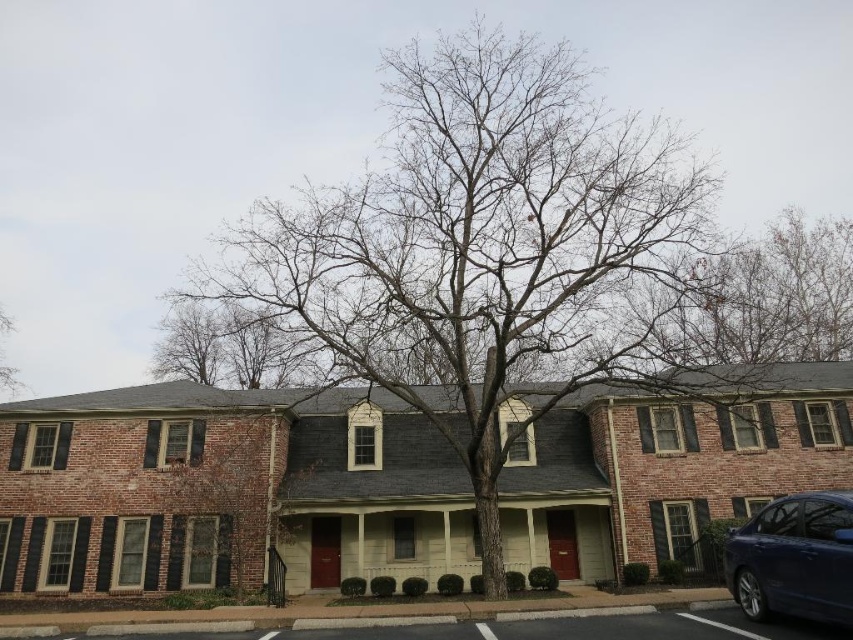
Who is shorter, bare branches at center or shiny dark blue sedan at lower right?

shiny dark blue sedan at lower right

This screenshot has height=640, width=853. I want to click on bare branches at center, so click(x=494, y=257).